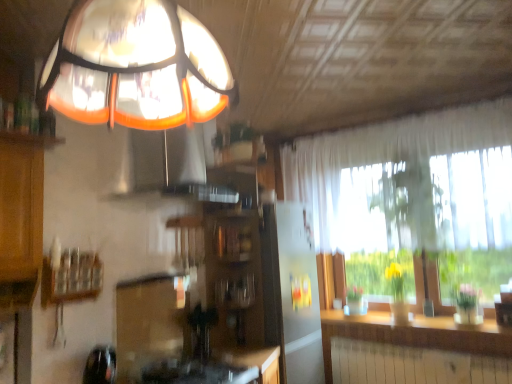
At what (x,y) coordinates should I click in order to perform the action: click on empty space that is ontop of translucent white curtain at right (from a real-world perspective). Please return your answer as a coordinate pair (x, y). This screenshot has width=512, height=384. Looking at the image, I should click on (387, 109).